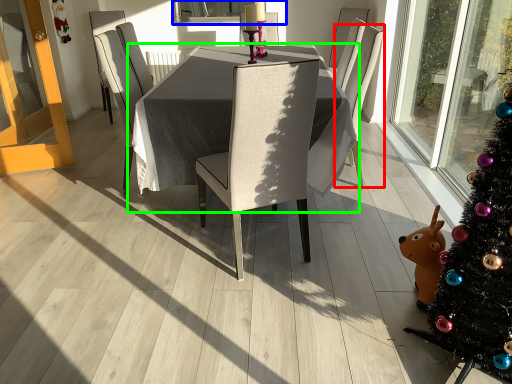
Question: Based on their relative distances, which object is farther from chair (highlighted by a red box)? Choose from window screen (highlighted by a blue box) and table (highlighted by a green box).

Choices:
 (A) window screen
 (B) table

Answer: (A)